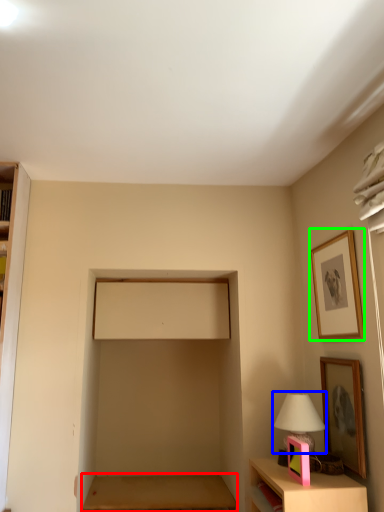
Question: Which object is the farthest from table (highlighted by a red box)? Choose among these: table lamp (highlighted by a blue box) or picture frame (highlighted by a green box).

Choices:
 (A) table lamp
 (B) picture frame

Answer: (B)